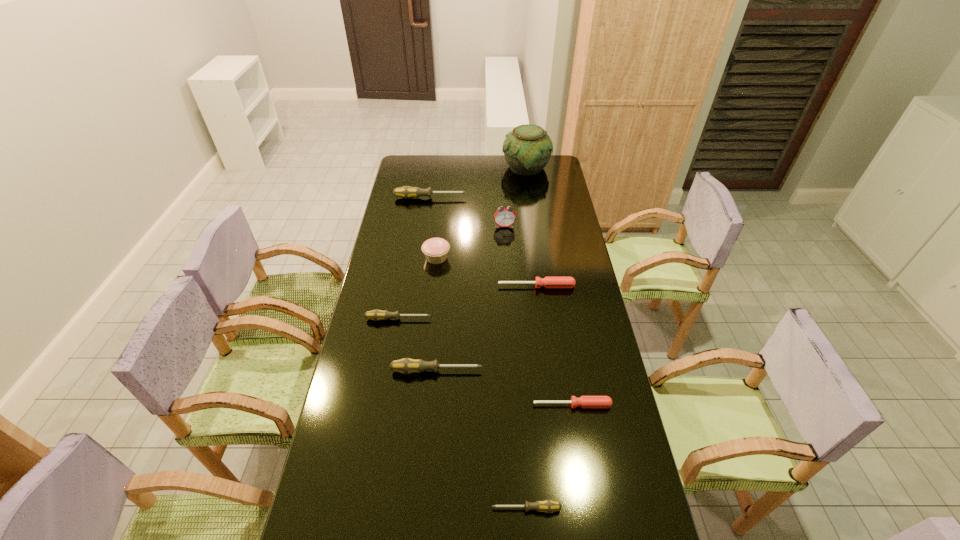
The width and height of the screenshot is (960, 540). In order to click on the sixth farthest object in this screenshot , I will do `click(376, 315)`.

Where is `the fourth nearest screwdriver`? The width and height of the screenshot is (960, 540). the fourth nearest screwdriver is located at coordinates click(x=376, y=315).

Identify the location of the bigger red screwdriver. coord(548,282).

Image resolution: width=960 pixels, height=540 pixels. I want to click on the second farthest screwdriver, so click(548, 282).

I want to click on the second nearest object, so click(x=584, y=401).

This screenshot has height=540, width=960. Identify the location of the nearer red screwdriver. click(x=584, y=401).

The image size is (960, 540). I want to click on the rightmost gray screwdriver, so click(548, 506).

Where is `the nearest screwdriver`? This screenshot has height=540, width=960. the nearest screwdriver is located at coordinates (548, 506).

Locate an element on the screen. The height and width of the screenshot is (540, 960). free location located on the left of the pottery is located at coordinates (472, 167).

This screenshot has height=540, width=960. Find the location of `vacant region located on the clock face of the second tallest object`. vacant region located on the clock face of the second tallest object is located at coordinates (509, 293).